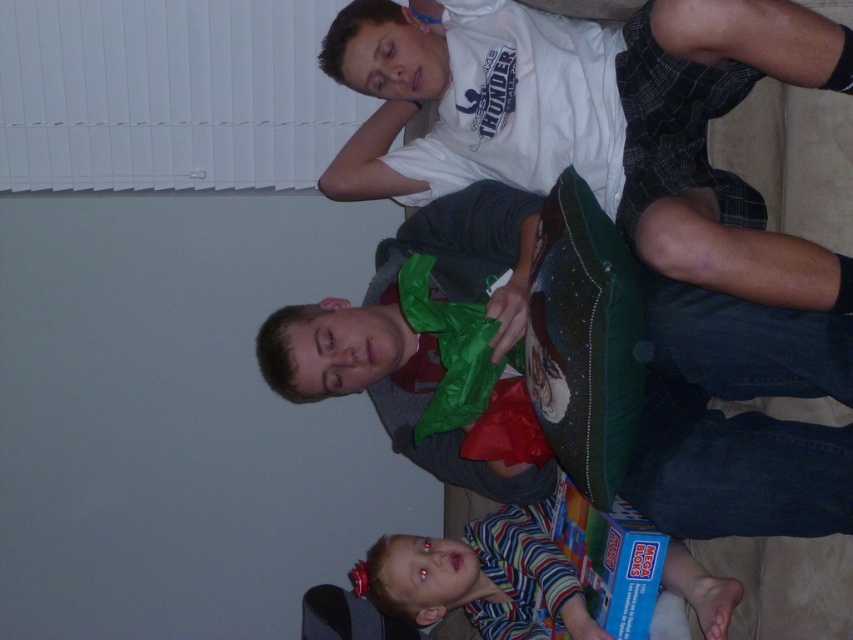
Does matte green pillow at center have a larger size compared to striped fabric shirt at lower center?

Indeed, matte green pillow at center has a larger size compared to striped fabric shirt at lower center.

Consider the image. Which is above, matte green pillow at center or striped fabric shirt at lower center?

Positioned higher is matte green pillow at center.

What do you see at coordinates (740, 417) in the screenshot?
I see `matte green pillow at center` at bounding box center [740, 417].

Where is `matte green pillow at center`? The width and height of the screenshot is (853, 640). matte green pillow at center is located at coordinates (740, 417).

Who is shorter, matte green pillow at center or blue cardboard box at lower center?

blue cardboard box at lower center is shorter.

Which is more to the left, matte green pillow at center or blue cardboard box at lower center?

From the viewer's perspective, matte green pillow at center appears more on the left side.

Where is `matte green pillow at center`? This screenshot has width=853, height=640. matte green pillow at center is located at coordinates (740, 417).

Who is taller, white cotton shirt at upper center or blue cardboard box at lower center?

white cotton shirt at upper center is taller.

Is white cotton shirt at upper center smaller than blue cardboard box at lower center?

Incorrect, white cotton shirt at upper center is not smaller in size than blue cardboard box at lower center.

You are a GUI agent. You are given a task and a screenshot of the screen. Output one action in this format:
    pyautogui.click(x=<x>, y=<y>)
    Task: Click on the white cotton shirt at upper center
    Image resolution: width=853 pixels, height=640 pixels.
    Given the screenshot: What is the action you would take?
    pyautogui.click(x=704, y=144)